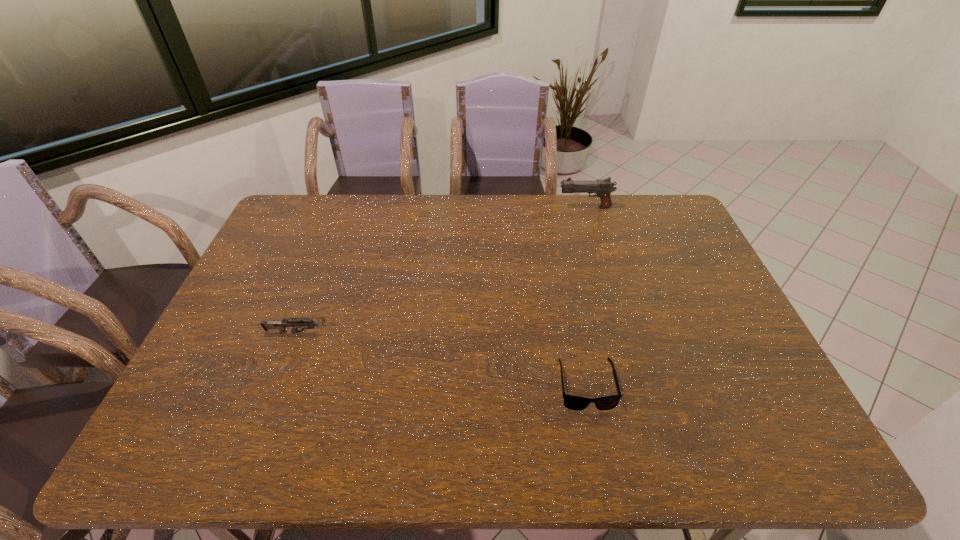
Identify the location of object that is at the far edge. (603, 188).

The image size is (960, 540). Identify the location of object that is at the left edge. [279, 325].

This screenshot has height=540, width=960. In the image, there is a desktop. In order to click on free space at the far edge in this screenshot , I will do `click(470, 201)`.

In the image, there is a desktop. Where is `vacant area at the near edge`? The image size is (960, 540). vacant area at the near edge is located at coordinates (600, 449).

This screenshot has width=960, height=540. Find the location of `blank space at the left edge of the desktop`. blank space at the left edge of the desktop is located at coordinates (229, 335).

In the image, there is a desktop. Where is `vacant space at the right edge`? vacant space at the right edge is located at coordinates (687, 253).

This screenshot has height=540, width=960. I want to click on vacant space at the far left corner, so click(323, 195).

The width and height of the screenshot is (960, 540). In the image, there is a desktop. Find the location of `vacant space at the near right corner`. vacant space at the near right corner is located at coordinates (763, 459).

The width and height of the screenshot is (960, 540). I want to click on free space between the nearest object and the taller gun, so click(x=586, y=296).

Locate an element on the screen. Image resolution: width=960 pixels, height=540 pixels. vacant space in between the farther gun and the nearest object is located at coordinates (586, 296).